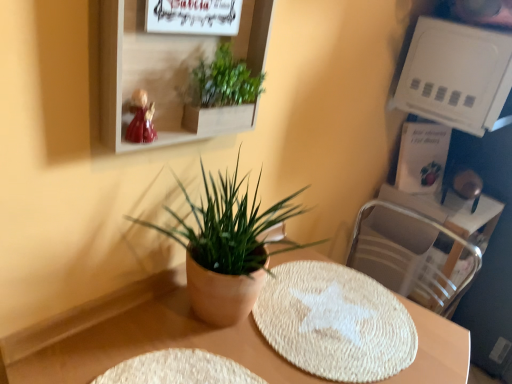
Question: Is white plastic shelf at upper right, which is counted as the second shelf, starting from the left, wider than matte white shelf at upper center, the first shelf when ordered from left to right?

Choices:
 (A) no
 (B) yes

Answer: (B)

Question: Is white plastic shelf at upper right, which ranks as the 1th shelf in right-to-left order, not within matte white shelf at upper center, placed as the second shelf when sorted from right to left?

Choices:
 (A) no
 (B) yes

Answer: (B)

Question: Is the position of white plastic shelf at upper right, which ranks as the 2th shelf in front-to-back order, less distant than that of matte white shelf at upper center, the first shelf when ordered from left to right?

Choices:
 (A) yes
 (B) no

Answer: (B)

Question: Does white plastic shelf at upper right, which is counted as the first shelf, starting from the back, appear on the right side of matte white shelf at upper center, which is counted as the first shelf, starting from the front?

Choices:
 (A) yes
 (B) no

Answer: (A)

Question: Does white plastic shelf at upper right, which is counted as the first shelf, starting from the back, have a lesser height compared to matte white shelf at upper center, which is counted as the first shelf, starting from the front?

Choices:
 (A) yes
 (B) no

Answer: (A)

Question: Considering the positions of white plastic shelf at upper right, which is counted as the second shelf, starting from the left, and metallic silver swivel chair at right in the image, is white plastic shelf at upper right, which is counted as the second shelf, starting from the left, wider or thinner than metallic silver swivel chair at right?

Choices:
 (A) thin
 (B) wide

Answer: (B)

Question: From their relative heights in the image, would you say white plastic shelf at upper right, which is counted as the first shelf, starting from the back, is taller or shorter than metallic silver swivel chair at right?

Choices:
 (A) short
 (B) tall

Answer: (A)

Question: From the image's perspective, is white plastic shelf at upper right, which is counted as the first shelf, starting from the back, above or below metallic silver swivel chair at right?

Choices:
 (A) below
 (B) above

Answer: (B)

Question: From a real-world perspective, is white plastic shelf at upper right, which is counted as the first shelf, starting from the back, physically located above or below metallic silver swivel chair at right?

Choices:
 (A) below
 (B) above

Answer: (B)

Question: Is white plastic shelf at upper right, which ranks as the 2th shelf in front-to-back order, in front of or behind green matte plant at center, arranged as the 2th houseplant when viewed from the top, in the image?

Choices:
 (A) front
 (B) behind

Answer: (B)

Question: Considering the positions of point (453, 71) and point (193, 264), is point (453, 71) closer or farther from the camera than point (193, 264)?

Choices:
 (A) farther
 (B) closer

Answer: (A)

Question: From a real-world perspective, relative to green matte plant at center, arranged as the 2th houseplant when viewed from the top, is white plastic shelf at upper right, which ranks as the 2th shelf in front-to-back order, vertically above or below?

Choices:
 (A) below
 (B) above

Answer: (B)

Question: Would you say white plastic shelf at upper right, which is counted as the second shelf, starting from the left, is to the left or to the right of green matte plant at center, arranged as the 2th houseplant when viewed from the top, in the picture?

Choices:
 (A) left
 (B) right

Answer: (B)

Question: Is white plastic shelf at upper right, which is counted as the first shelf, starting from the back, situated inside green leafy plant at upper center, which appears as the 1th houseplant when viewed from the top, or outside?

Choices:
 (A) inside
 (B) outside

Answer: (B)

Question: Is white plastic shelf at upper right, which ranks as the 1th shelf in right-to-left order, taller or shorter than green leafy plant at upper center, which appears as the 1th houseplant when viewed from the top?

Choices:
 (A) tall
 (B) short

Answer: (A)